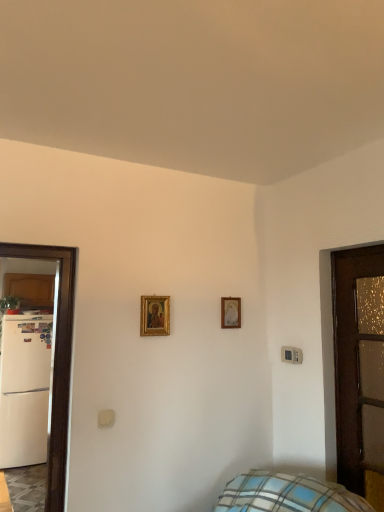
This screenshot has height=512, width=384. Find the location of `brown wooden door at right`. brown wooden door at right is located at coordinates (358, 362).

Measure the distance between point (x=32, y=402) and camera.

A distance of 4.77 meters exists between point (x=32, y=402) and camera.

What do you see at coordinates (155, 315) in the screenshot?
I see `gold-framed painting at center, marked as the 1th picture frame in a left-to-right arrangement` at bounding box center [155, 315].

Identify the location of brown wooden door at right. (358, 362).

Does brown wooden door at right turn towards white matte refrigerator at left?

No, brown wooden door at right is not aimed at white matte refrigerator at left.

Which point is more forward, (348,421) or (26,329)?

The point (348,421) is closer to the camera.

Which of these two, brown wooden door at right or white matte refrigerator at left, stands shorter?

With less height is brown wooden door at right.

The image size is (384, 512). Identify the location of fridge that appears behind the brown wooden door at right. (24, 389).

Measure the distance from white matte refrigerator at left to brown wooden door at right.

A distance of 3.74 meters exists between white matte refrigerator at left and brown wooden door at right.

From the picture: How different are the orientations of white matte refrigerator at left and brown wooden door at right in degrees?

white matte refrigerator at left and brown wooden door at right are facing 90.4 degrees away from each other.

Between point (20, 428) and point (348, 460), which one is positioned in front?

The point (348, 460) is more forward.

Are white matte refrigerator at left and brown wooden door at right far apart?

That's right, there is a large distance between white matte refrigerator at left and brown wooden door at right.

What's the angular difference between gold-framed painting at center, marked as the 2th picture frame in a right-to-left arrangement, and gold-framed picture at center, arranged as the 1th picture frame when viewed from the back,'s facing directions?

1.12 degrees.

You are a GUI agent. You are given a task and a screenshot of the screen. Output one action in this format:
    pyautogui.click(x=<x>, y=<y>)
    Task: Click on the picture frame located in front of the gold-framed picture at center, arranged as the second picture frame when viewed from the front
    This screenshot has height=512, width=384.
    Given the screenshot: What is the action you would take?
    pyautogui.click(x=155, y=315)

Which is correct: gold-framed painting at center, which is the 1th picture frame in front-to-back order, is inside gold-framed picture at center, the 1th picture frame positioned from the right, or outside of it?

The correct answer is: outside.

Considering the sizes of objects gold-framed painting at center, which is the 1th picture frame in front-to-back order, and gold-framed picture at center, arranged as the 1th picture frame when viewed from the back, in the image provided, who is shorter, gold-framed painting at center, which is the 1th picture frame in front-to-back order, or gold-framed picture at center, arranged as the 1th picture frame when viewed from the back,?

gold-framed picture at center, arranged as the 1th picture frame when viewed from the back, is shorter.

Can you confirm if gold-framed picture at center, arranged as the 1th picture frame when viewed from the back, is positioned to the right of gold-framed painting at center, positioned as the 2th picture frame in back-to-front order?

Indeed, gold-framed picture at center, arranged as the 1th picture frame when viewed from the back, is positioned on the right side of gold-framed painting at center, positioned as the 2th picture frame in back-to-front order.

Identify the location of picture frame on the left side of gold-framed picture at center, the 2th picture frame viewed from the left. (155, 315).

How distant is gold-framed picture at center, the 2th picture frame viewed from the left, from gold-framed painting at center, positioned as the 2th picture frame in back-to-front order?

They are 15.87 inches apart.

Is gold-framed picture at center, arranged as the second picture frame when viewed from the front, wider than gold-framed painting at center, which is the 1th picture frame in front-to-back order?

In fact, gold-framed picture at center, arranged as the second picture frame when viewed from the front, might be narrower than gold-framed painting at center, which is the 1th picture frame in front-to-back order.

Considering the points (350, 425) and (237, 298), which point is behind, point (350, 425) or point (237, 298)?

The point (237, 298) is behind.

Is brown wooden door at right at the left side of gold-framed picture at center, the 1th picture frame positioned from the right?

In fact, brown wooden door at right is to the right of gold-framed picture at center, the 1th picture frame positioned from the right.

From a real-world perspective, is brown wooden door at right below gold-framed picture at center, arranged as the second picture frame when viewed from the front?

Yes, from a real-world perspective, brown wooden door at right is beneath gold-framed picture at center, arranged as the second picture frame when viewed from the front.

Is brown wooden door at right facing towards gold-framed picture at center, arranged as the second picture frame when viewed from the front?

No.

Is gold-framed painting at center, which is the 1th picture frame in front-to-back order, aimed at white matte refrigerator at left?

No.

Can you confirm if gold-framed painting at center, positioned as the 2th picture frame in back-to-front order, is positioned to the right of white matte refrigerator at left?

Yes.

From the image's perspective, is gold-framed painting at center, which is the 1th picture frame in front-to-back order, above or below white matte refrigerator at left?

gold-framed painting at center, which is the 1th picture frame in front-to-back order, is above white matte refrigerator at left.

Do you think gold-framed painting at center, marked as the 1th picture frame in a left-to-right arrangement, is within brown wooden door at right, or outside of it?

gold-framed painting at center, marked as the 1th picture frame in a left-to-right arrangement, is not inside brown wooden door at right, it's outside.

Which of these two, gold-framed painting at center, marked as the 2th picture frame in a right-to-left arrangement, or brown wooden door at right, is thinner?

Thinner between the two is gold-framed painting at center, marked as the 2th picture frame in a right-to-left arrangement.

In the scene shown: Which point is more distant from viewer, (x=151, y=330) or (x=345, y=414)?

The point (x=151, y=330) is farther.

Does gold-framed painting at center, marked as the 2th picture frame in a right-to-left arrangement, have a lesser height compared to brown wooden door at right?

Indeed, gold-framed painting at center, marked as the 2th picture frame in a right-to-left arrangement, has a lesser height compared to brown wooden door at right.

The height and width of the screenshot is (512, 384). Identify the location of door on the right of white matte refrigerator at left. (358, 362).

At what (x,y) coordinates should I click in order to perform the action: click on door located above the white matte refrigerator at left (from a real-world perspective). Please return your answer as a coordinate pair (x, y). This screenshot has height=512, width=384. Looking at the image, I should click on (358, 362).

From the image, which object appears to be farther from white matte refrigerator at left, gold-framed painting at center, which is the 1th picture frame in front-to-back order, or brown wooden door at right?

Based on the image, brown wooden door at right appears to be further to white matte refrigerator at left.

Which object lies further to the anchor point gold-framed painting at center, marked as the 1th picture frame in a left-to-right arrangement, gold-framed picture at center, the 2th picture frame viewed from the left, or brown wooden door at right?

Among the two, brown wooden door at right is located further to gold-framed painting at center, marked as the 1th picture frame in a left-to-right arrangement.

Estimate the real-world distances between objects in this image. Which object is closer to brown wooden door at right, white matte refrigerator at left or gold-framed painting at center, positioned as the 2th picture frame in back-to-front order?

gold-framed painting at center, positioned as the 2th picture frame in back-to-front order, is closer to brown wooden door at right.

Estimate the real-world distances between objects in this image. Which object is further from gold-framed picture at center, arranged as the second picture frame when viewed from the front, white matte refrigerator at left or gold-framed painting at center, marked as the 2th picture frame in a right-to-left arrangement?

white matte refrigerator at left is further to gold-framed picture at center, arranged as the second picture frame when viewed from the front.

Considering their positions, is gold-framed painting at center, marked as the 1th picture frame in a left-to-right arrangement, positioned closer to white matte refrigerator at left than gold-framed picture at center, the 1th picture frame positioned from the right?

gold-framed painting at center, marked as the 1th picture frame in a left-to-right arrangement, is closer to white matte refrigerator at left.

From the image, which object appears to be farther from gold-framed painting at center, marked as the 2th picture frame in a right-to-left arrangement, white matte refrigerator at left or brown wooden door at right?

Based on the image, white matte refrigerator at left appears to be further to gold-framed painting at center, marked as the 2th picture frame in a right-to-left arrangement.

Looking at the image, which one is located closer to gold-framed picture at center, the 2th picture frame viewed from the left, gold-framed painting at center, marked as the 2th picture frame in a right-to-left arrangement, or brown wooden door at right?

gold-framed painting at center, marked as the 2th picture frame in a right-to-left arrangement, lies closer to gold-framed picture at center, the 2th picture frame viewed from the left, than the other object.

Which object lies nearer to the anchor point white matte refrigerator at left, brown wooden door at right or gold-framed painting at center, marked as the 1th picture frame in a left-to-right arrangement?

Based on the image, gold-framed painting at center, marked as the 1th picture frame in a left-to-right arrangement, appears to be nearer to white matte refrigerator at left.

The width and height of the screenshot is (384, 512). In order to click on picture frame between gold-framed painting at center, marked as the 2th picture frame in a right-to-left arrangement, and brown wooden door at right, in the horizontal direction in this screenshot , I will do `click(230, 312)`.

The width and height of the screenshot is (384, 512). I want to click on picture frame positioned between gold-framed painting at center, marked as the 2th picture frame in a right-to-left arrangement, and white matte refrigerator at left from near to far, so click(230, 312).